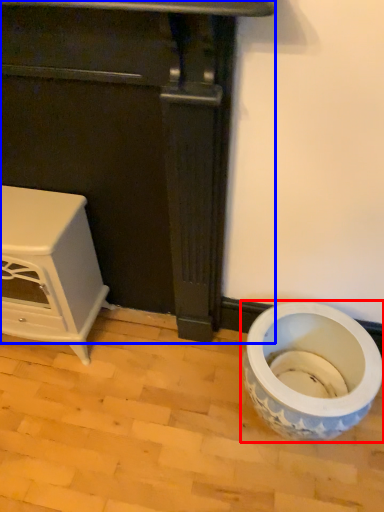
Question: Which point is further to the camera, toilet (highlighted by a red box) or furniture (highlighted by a blue box)?

Choices:
 (A) toilet
 (B) furniture

Answer: (A)